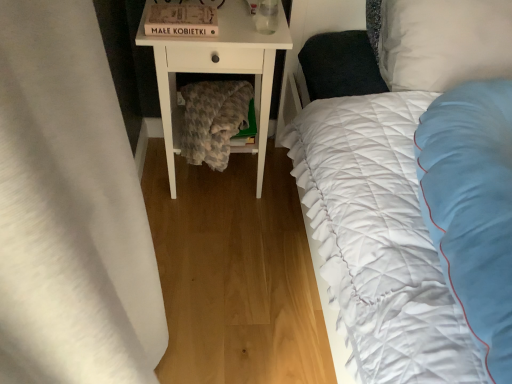
The image size is (512, 384). What are the coordinates of `free point below white matte nightstand at center (from a real-world perspective)` in the screenshot? It's located at (220, 177).